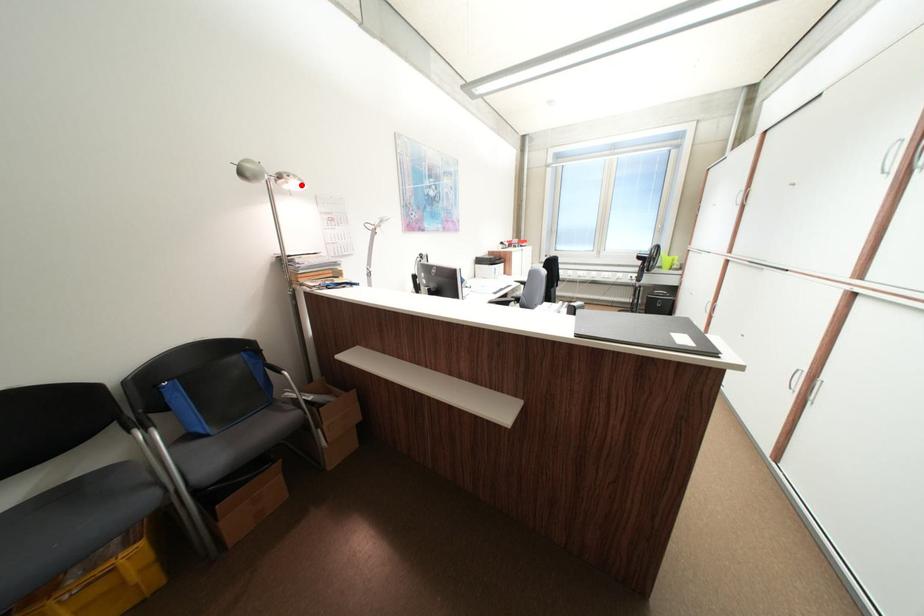
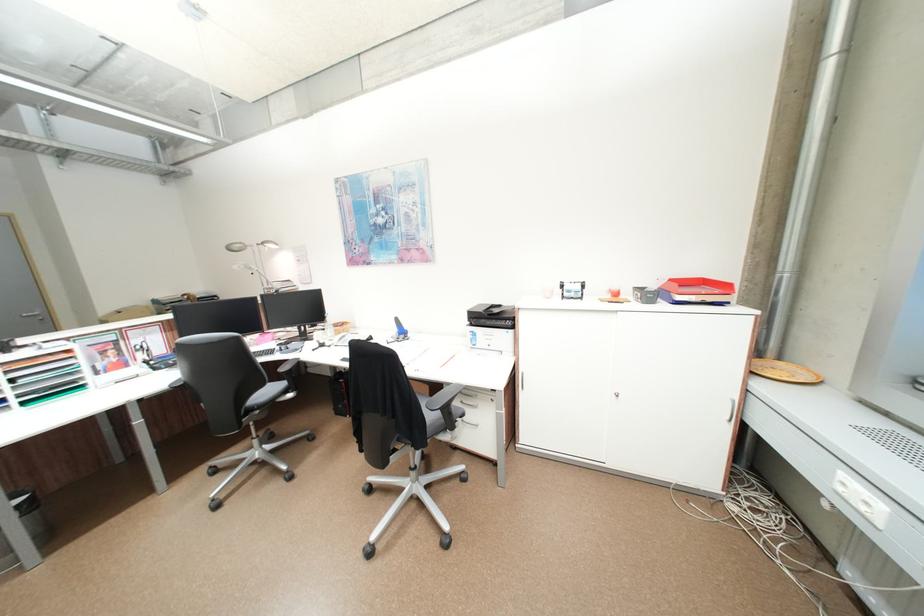
The point at the highlighted location is marked in the first image. Where is the corresponding point in the second image?

(281, 246)